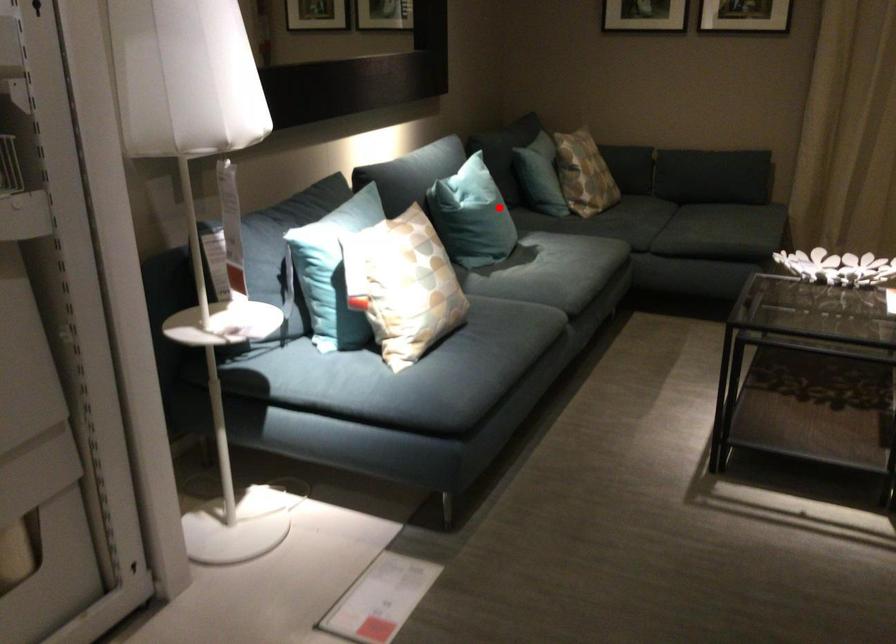
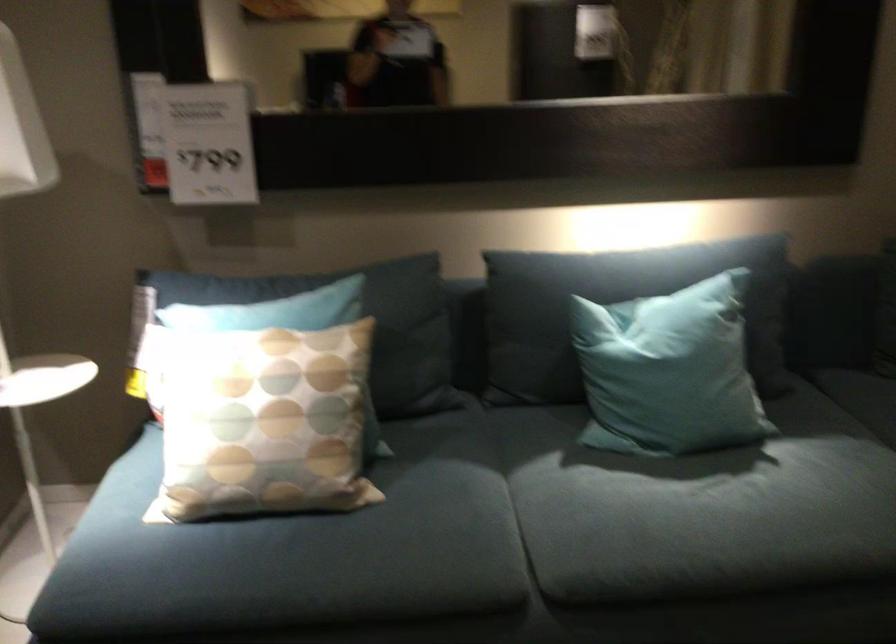
Question: I am providing you with two images of the same scene from different viewpoints. A red point is marked on the first image. At the location where the point appears in image 1, is it still visible in image 2?

Choices:
 (A) Yes
 (B) No

Answer: (A)